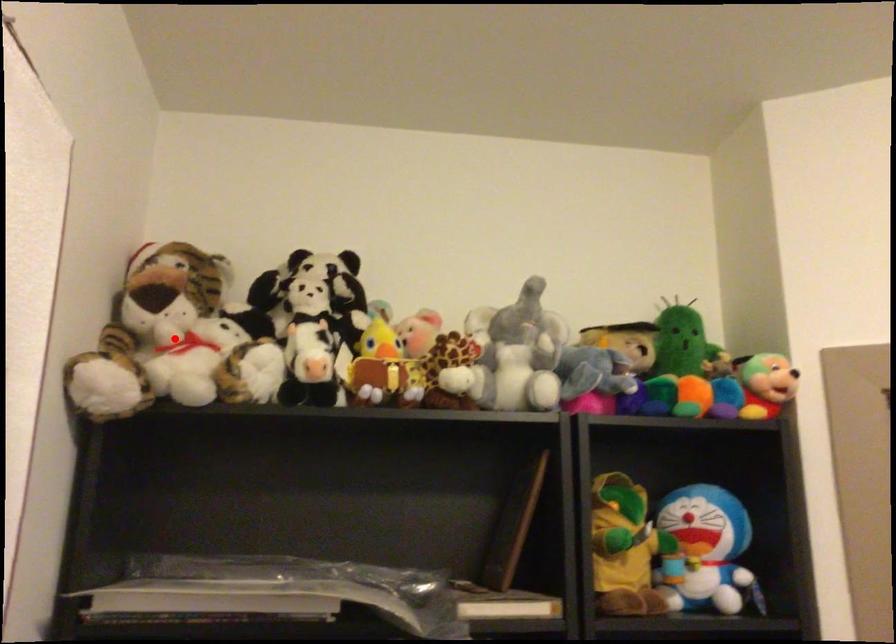
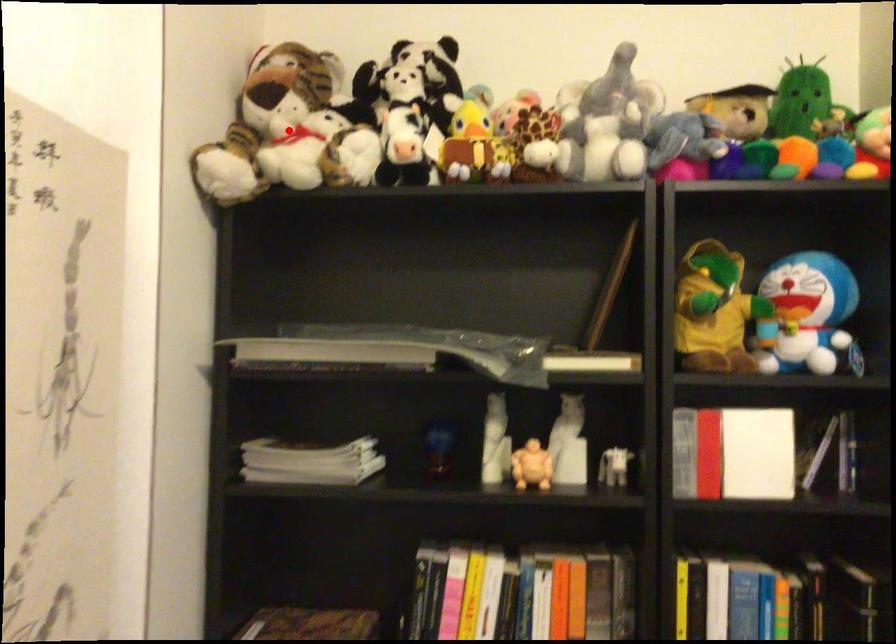
I am providing you with two images of the same scene from different viewpoints. A red point is marked on the first image and another point is marked on the second image. Is the red point in image1 aligned with the point shown in image2?

Yes